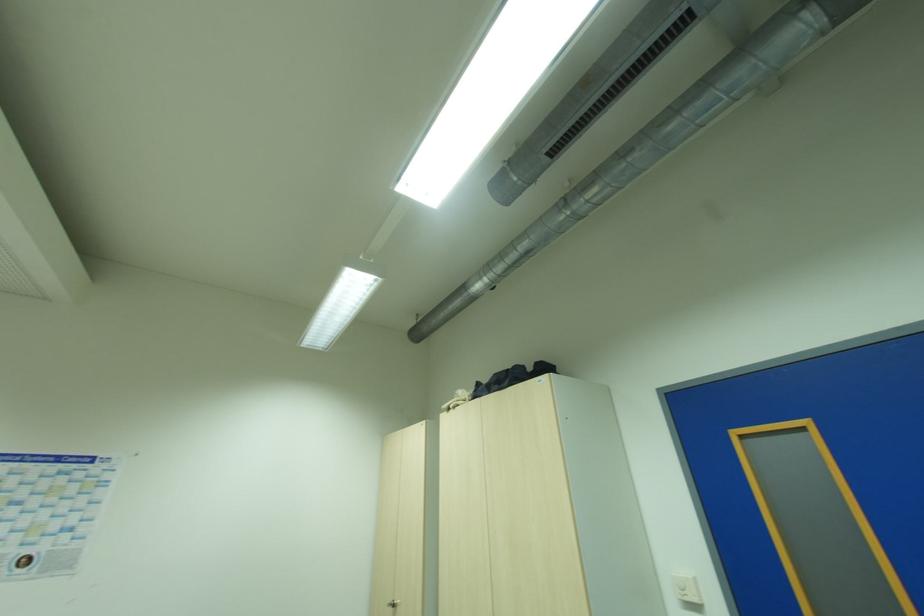
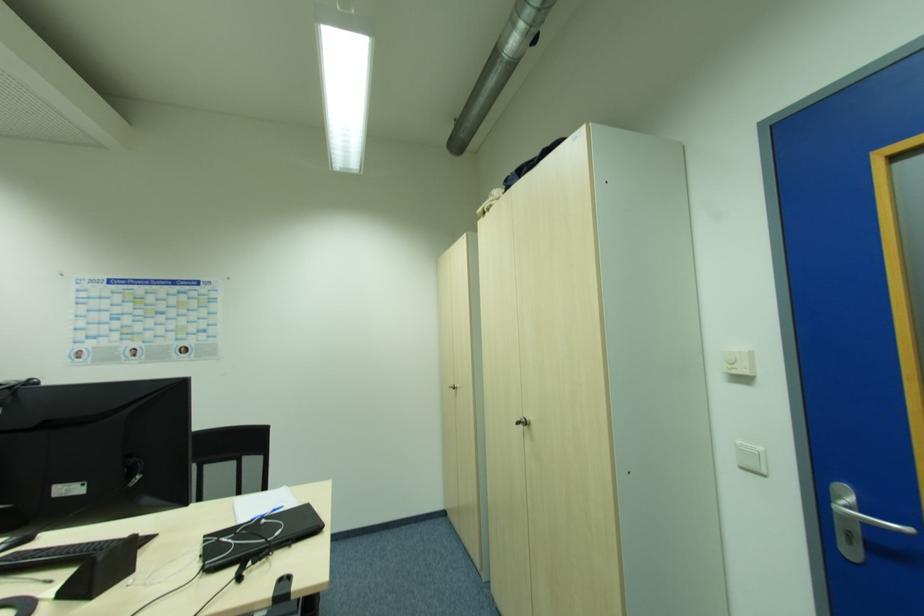
First-person continuous shooting, in which direction is the camera rotating?

The rotation direction of the camera is left-down.